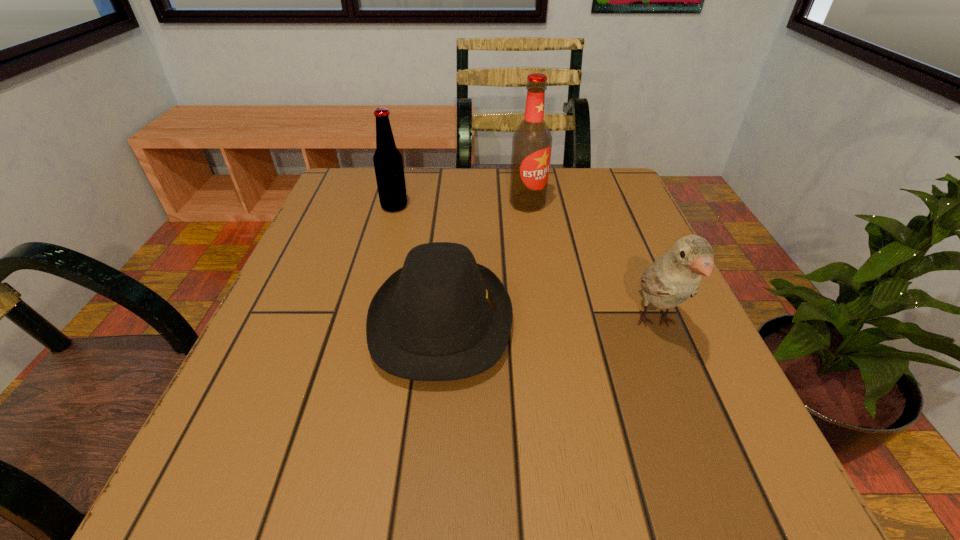
You are a GUI agent. You are given a task and a screenshot of the screen. Output one action in this format:
    pyautogui.click(x=<x>, y=<y>)
    Task: Click on the object that is at the right edge
    
    Given the screenshot: What is the action you would take?
    pos(675,276)

At what (x,y) coordinates should I click in order to perform the action: click on object located in the far left corner section of the desktop. Please return your answer as a coordinate pair (x, y). Looking at the image, I should click on (388, 164).

The image size is (960, 540). I want to click on vacant region at the far edge of the desktop, so point(506,213).

In the image, there is a desktop. At what (x,y) coordinates should I click in order to perform the action: click on free space at the near edge. Please return your answer as a coordinate pair (x, y). Image resolution: width=960 pixels, height=540 pixels. Looking at the image, I should click on (308, 514).

Identify the location of vacant space at the left edge of the desktop. The height and width of the screenshot is (540, 960). (290, 273).

In order to click on blank space at the right edge in this screenshot , I will do `click(606, 261)`.

Find the location of a particular element. The width and height of the screenshot is (960, 540). vacant space at the far left corner of the desktop is located at coordinates (379, 205).

Locate an element on the screen. This screenshot has width=960, height=540. vacant space at the near left corner of the desktop is located at coordinates (300, 514).

You are a GUI agent. You are given a task and a screenshot of the screen. Output one action in this format:
    pyautogui.click(x=<x>, y=<y>)
    Task: Click on the vacant space at the far right corner
    Image resolution: width=960 pixels, height=540 pixels.
    Given the screenshot: What is the action you would take?
    pyautogui.click(x=585, y=198)

Image resolution: width=960 pixels, height=540 pixels. I want to click on empty space that is in between the left beer bottle and the taller beer bottle, so click(461, 205).